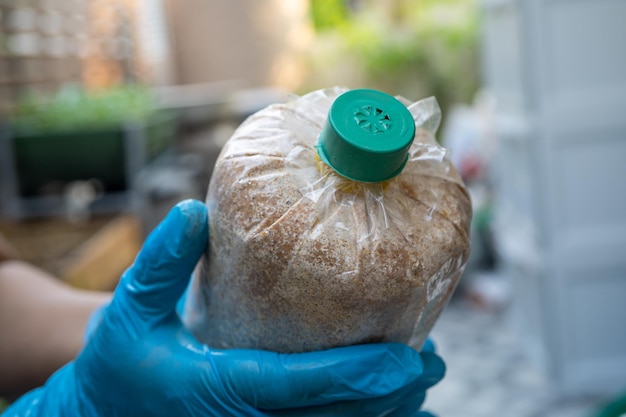
You are a GUI agent. You are given a task and a screenshot of the screen. Output one action in this format:
    pyautogui.click(x=<x>, y=<y>)
    Task: Click on the green plants
    Image resolution: width=626 pixels, height=417 pixels.
    Given the screenshot: What is the action you would take?
    pyautogui.click(x=86, y=109)